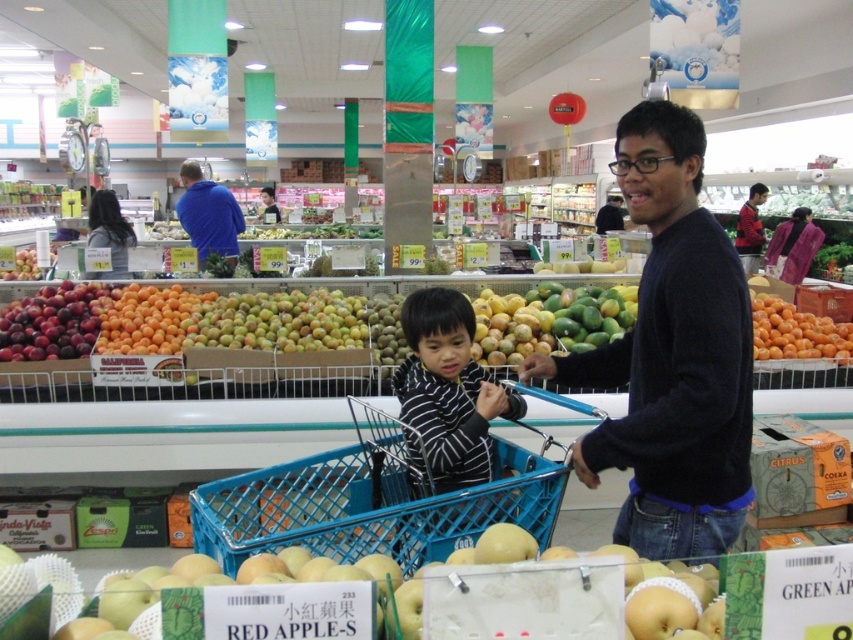
Question: Which point is farther to the camera?

Choices:
 (A) striped cotton shirt at center
 (B) red shirt at upper right
 (C) blue fleece jacket at upper center
 (D) smooth yellow apples at lower center

Answer: (B)

Question: Is red shirt at upper right closer to the viewer compared to black sweater at center?

Choices:
 (A) no
 (B) yes

Answer: (B)

Question: Which object is farther from the camera taking this photo?

Choices:
 (A) dark blue sweater at center
 (B) shiny purple plums at left
 (C) orange matte at right
 (D) blue fleece jacket at upper center

Answer: (D)

Question: Can you confirm if dark blue sweater at center is wider than smooth yellow apples at lower center?

Choices:
 (A) no
 (B) yes

Answer: (A)

Question: Which object appears closest to the camera in this image?

Choices:
 (A) smooth yellow apples at lower center
 (B) red shirt at upper right
 (C) blue fleece jacket at upper center
 (D) black sweater at center

Answer: (A)

Question: Does shiny purple plums at left appear on the right side of black sweater at center?

Choices:
 (A) no
 (B) yes

Answer: (A)